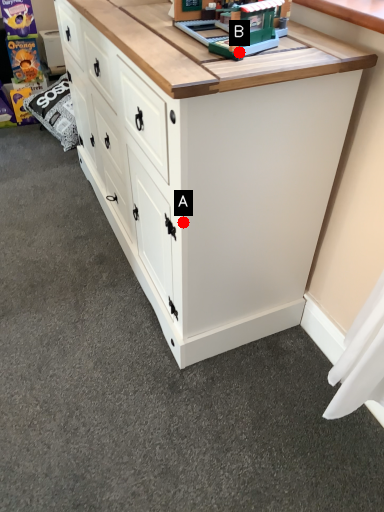
Question: Two points are circled on the image, labeled by A and B beside each circle. Which point is farther from the camera taking this photo?

Choices:
 (A) A is further
 (B) B is further

Answer: (A)